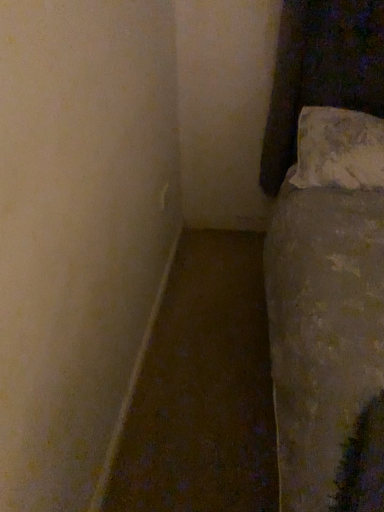
What do you see at coordinates (338, 149) in the screenshot? Image resolution: width=384 pixels, height=512 pixels. I see `white textured pillow at upper right` at bounding box center [338, 149].

At what (x,y) coordinates should I click in order to perform the action: click on white textured pillow at upper right. Please return your answer as a coordinate pair (x, y). This screenshot has height=512, width=384. Looking at the image, I should click on (338, 149).

Measure the distance between point (371,146) and camera.

The distance of point (371,146) from camera is 1.60 meters.

The height and width of the screenshot is (512, 384). In order to click on white textured pillow at upper right in this screenshot , I will do `click(338, 149)`.